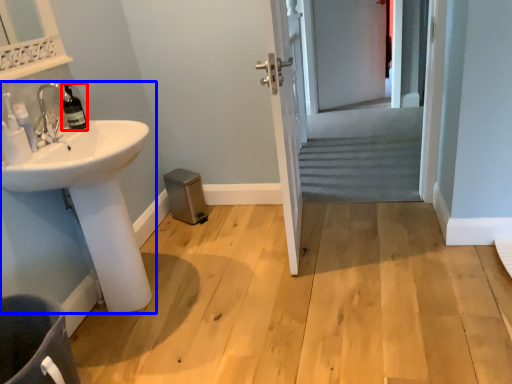
Question: Which of the following is the closest to the observer, bottle (highlighted by a red box) or sink (highlighted by a blue box)?

Choices:
 (A) bottle
 (B) sink

Answer: (B)